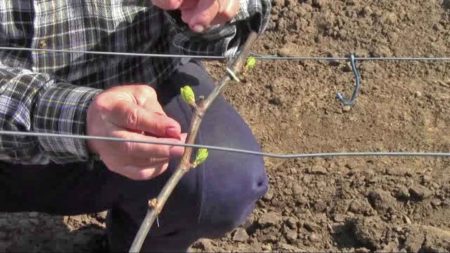
Locate an element on the screen. Image resolution: width=450 pixels, height=253 pixels. green budding plant is located at coordinates (189, 91), (247, 63), (202, 151).